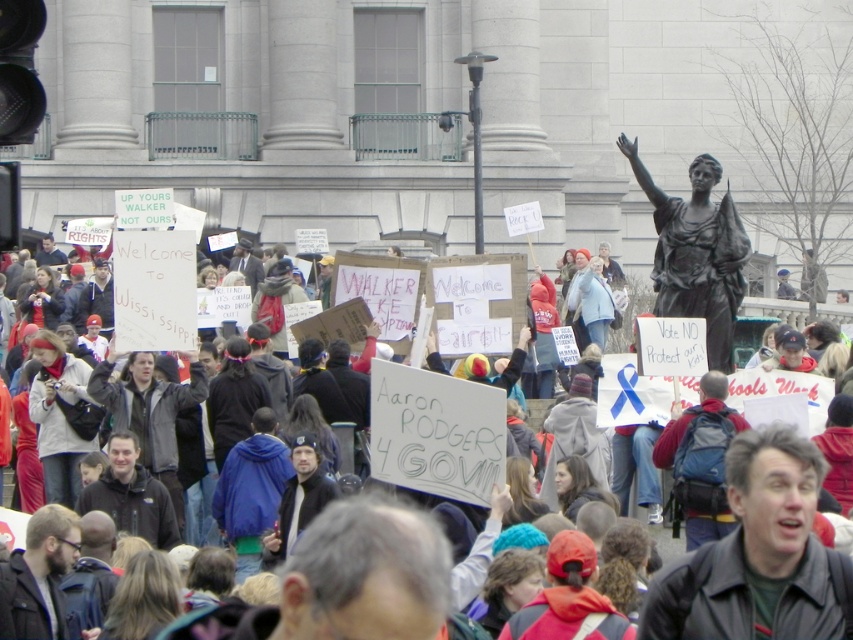
Question: Which point is closer to the camera taking this photo?

Choices:
 (A) (131, 234)
 (B) (679, 253)

Answer: (A)

Question: Which object is positioned farthest from the white cardboard sign at center?

Choices:
 (A) bronze statue at upper right
 (B) black leather jacket at lower right

Answer: (A)

Question: Does black leather jacket at lower right have a lesser width compared to white cardboard sign at center?

Choices:
 (A) no
 (B) yes

Answer: (B)

Question: From the image, what is the correct spatial relationship of black leather jacket at lower right in relation to white cardboard sign at center?

Choices:
 (A) above
 (B) below

Answer: (B)

Question: Observing the image, what is the correct spatial positioning of black leather jacket at lower right in reference to white cardboard sign at center?

Choices:
 (A) left
 (B) right

Answer: (B)

Question: Among these points, which one is nearest to the camera?

Choices:
 (A) (730, 204)
 (B) (811, 490)
 (C) (821, 625)

Answer: (C)